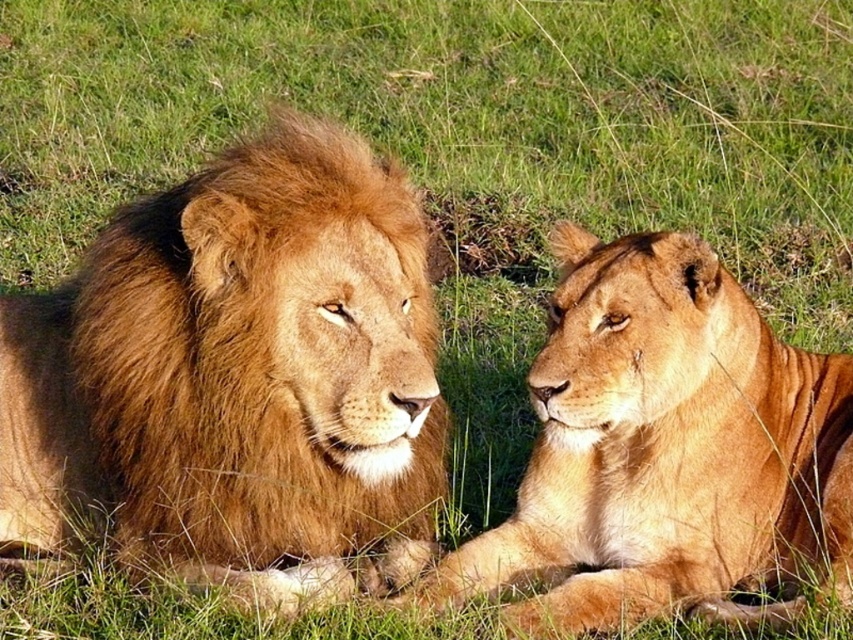
Can you confirm if golden fur lion at left is smaller than golden fur lion at center?

No.

Who is lower down, golden fur lion at left or golden fur lion at center?

golden fur lion at center

Is point (48, 433) positioned in front of point (793, 483)?

That is True.

At what (x,y) coordinates should I click in order to perform the action: click on golden fur lion at left. Please return your answer as a coordinate pair (x, y). The image size is (853, 640). Looking at the image, I should click on (238, 380).